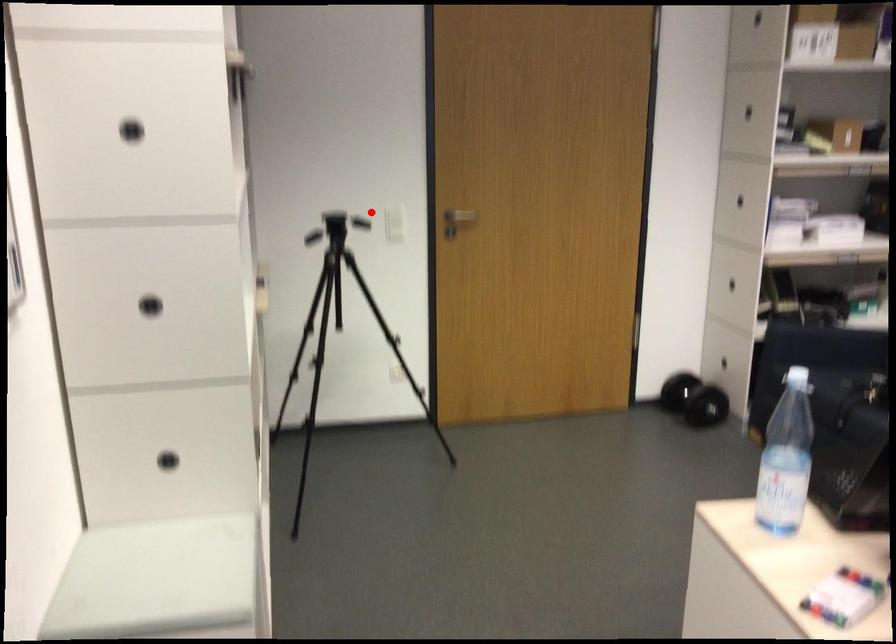
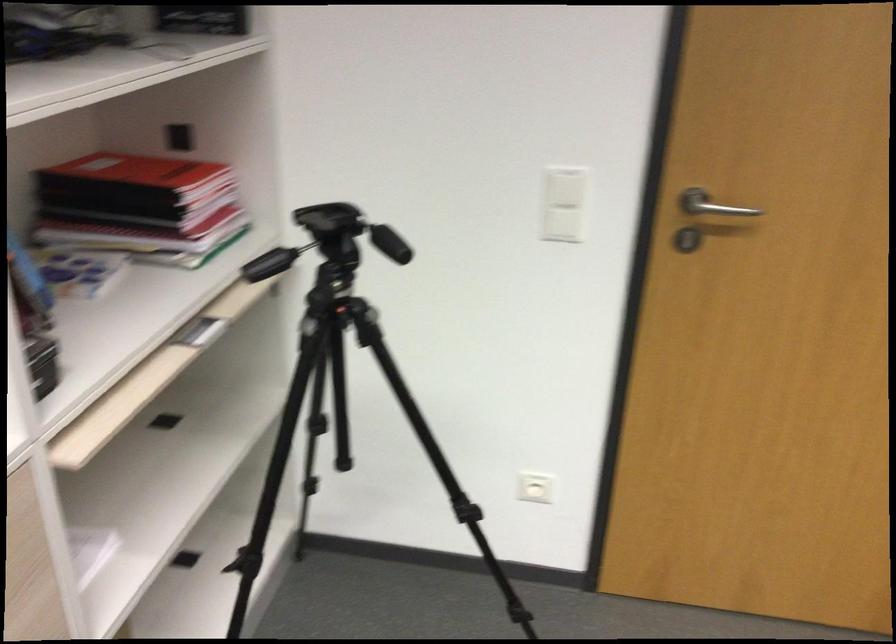
Question: A red point is marked in image1. In image2, is the corresponding 3D point closer to the camera or farther? Reply with the corresponding letter.

Choices:
 (A) The corresponding 3D point is closer.
 (B) The corresponding 3D point is farther.

Answer: (A)